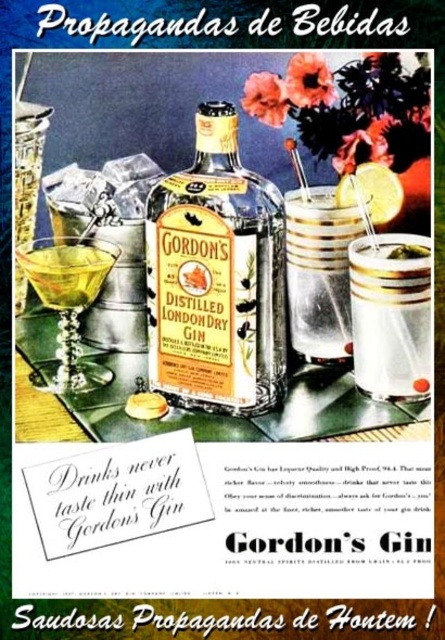
You are a bartender preparing a cocktail. You have a matte glass bottle at center and a clear plastic cup at center in front of you. Which object should you pour the gin into first to follow proper mixing technique?

The proper mixing technique requires pouring the gin into the clear plastic cup at center first, as the matte glass bottle at center is positioned over it, ensuring the liquid flows correctly.

You are holding a ruler and want to measure the distance from your eyes to the point at the bottom center of the bottle. The point is labeled as point (429, 312). Can you determine the distance using the ruler?

The distance between point (429, 312) and the viewer is 25.27 inches, so you can measure it as 25.27 inches using the ruler.

You are a bartender preparing a drink for a customer. You have a clear plastic cup at center and a clear glass cocktail at center in front of you. Which object takes up more space on the table?

The clear glass cocktail at center occupies more space than the clear plastic cup at center.